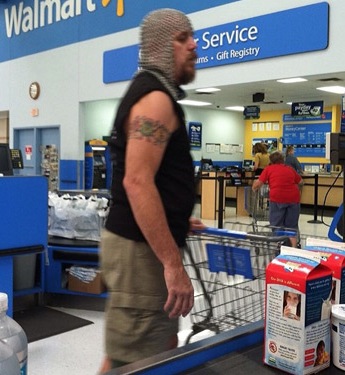
Where is `tile floor`? The height and width of the screenshot is (375, 345). tile floor is located at coordinates (85, 350).